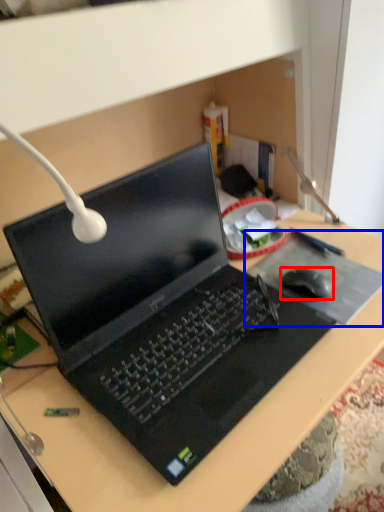
Question: Which object is closer to the camera taking this photo, mouse (highlighted by a red box) or mousepad (highlighted by a blue box)?

Choices:
 (A) mouse
 (B) mousepad

Answer: (B)